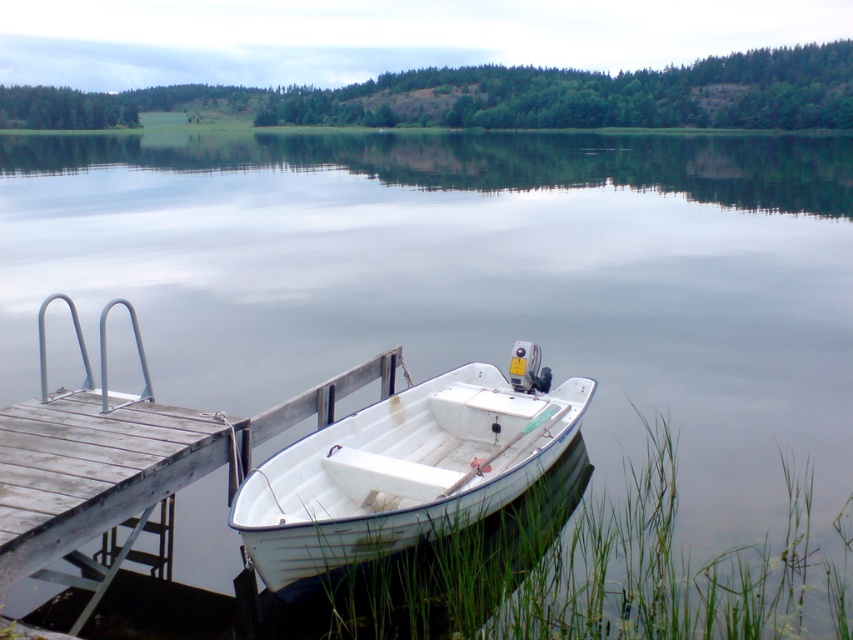
Looking at this image, between white matte boat at lower center and wooden dock at lower left, which one appears on the left side from the viewer's perspective?

From the viewer's perspective, wooden dock at lower left appears more on the left side.

Looking at this image, can you confirm if white matte boat at lower center is positioned below wooden dock at lower left?

Yes, white matte boat at lower center is below wooden dock at lower left.

In order to click on white matte boat at lower center in this screenshot , I will do pos(404,468).

Find the location of a particular element. This screenshot has height=640, width=853. white matte boat at lower center is located at coordinates (404, 468).